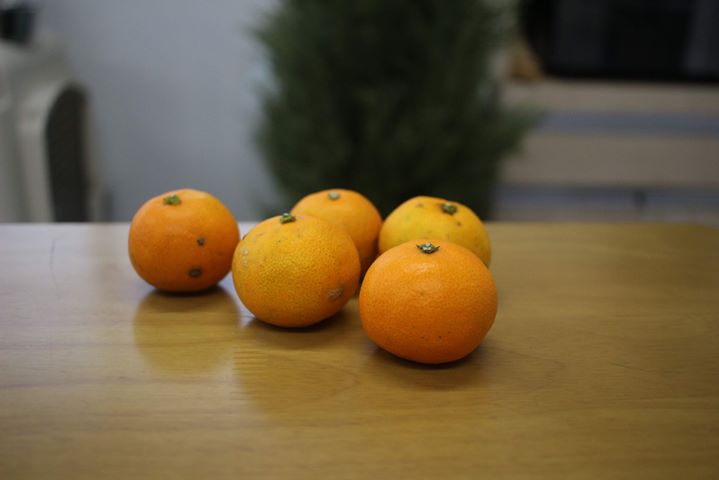
What are the coordinates of `dark graining of wood` in the screenshot? It's located at (669, 405), (211, 425), (170, 410), (178, 381), (162, 347), (155, 325).